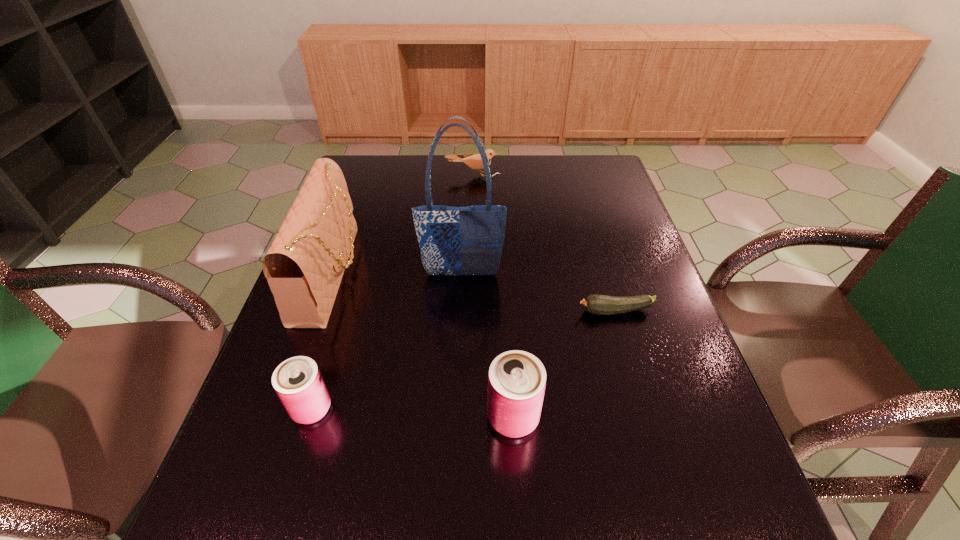
Where is `the shorter can`? This screenshot has height=540, width=960. the shorter can is located at coordinates (298, 382).

What are the coordinates of `the left can` in the screenshot? It's located at (298, 382).

Where is `the taller can`? The width and height of the screenshot is (960, 540). the taller can is located at coordinates (517, 379).

This screenshot has width=960, height=540. Find the location of `the fourth shortest object`. the fourth shortest object is located at coordinates pyautogui.click(x=517, y=379).

Find the location of `the second shortest object`. the second shortest object is located at coordinates (474, 161).

The height and width of the screenshot is (540, 960). Find the location of `the farthest object`. the farthest object is located at coordinates (474, 161).

Locate an element on the screen. the shortest object is located at coordinates (595, 304).

Find the location of a particular element. the rightmost object is located at coordinates (595, 304).

Locate an element on the screen. shopping bag is located at coordinates (469, 240).

Find the location of a particular element. This screenshot has height=540, width=960. the fifth shortest object is located at coordinates (304, 267).